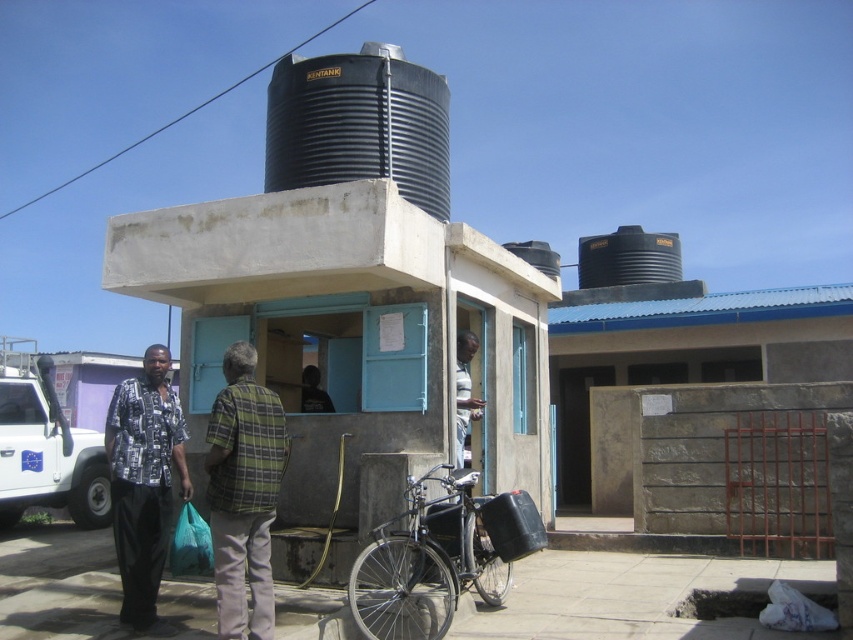
Which is more to the left, black corrugated silo at upper center or plaid shirt at center?

black corrugated silo at upper center is more to the left.

Can you confirm if black corrugated silo at upper center is bigger than plaid shirt at center?

Yes.

Is point (383, 49) positioned behind point (462, 358)?

Yes, point (383, 49) is behind point (462, 358).

I want to click on black corrugated silo at upper center, so click(358, 124).

Who is more forward, (479,518) or (460,362)?

Point (479,518) is in front.

Does shiny black bicycle at center have a greater height compared to plaid shirt at center?

No.

The image size is (853, 640). What are the coordinates of `shiny black bicycle at center` in the screenshot? It's located at (426, 563).

Is the position of shiny black bicycle at center less distant than that of green plaid shirt at center?

No, it is behind green plaid shirt at center.

Which of these two, shiny black bicycle at center or green plaid shirt at center, stands shorter?

With less height is shiny black bicycle at center.

Is point (439, 630) closer to camera compared to point (216, 442)?

That is False.

Where is `shiny black bicycle at center`? The image size is (853, 640). shiny black bicycle at center is located at coordinates (426, 563).